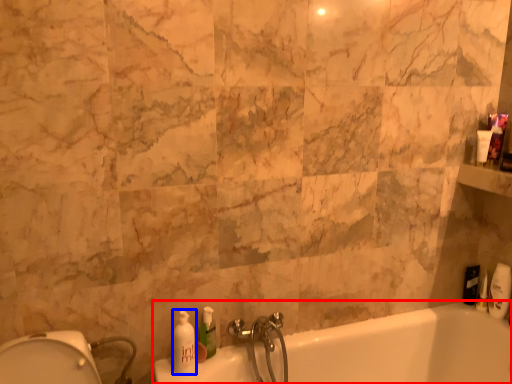
Question: Which point is closer to the camera, bathtub (highlighted by a red box) or soap dispenser (highlighted by a blue box)?

Choices:
 (A) bathtub
 (B) soap dispenser

Answer: (A)